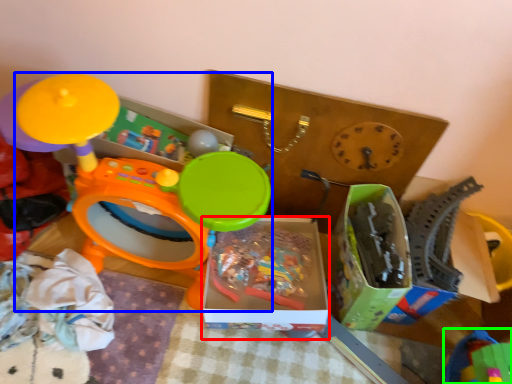
Question: Estimate the real-world distances between objects in this image. Which object is farther from storage box (highlighted by a red box), toy (highlighted by a blue box) or toy (highlighted by a green box)?

Choices:
 (A) toy
 (B) toy

Answer: (B)